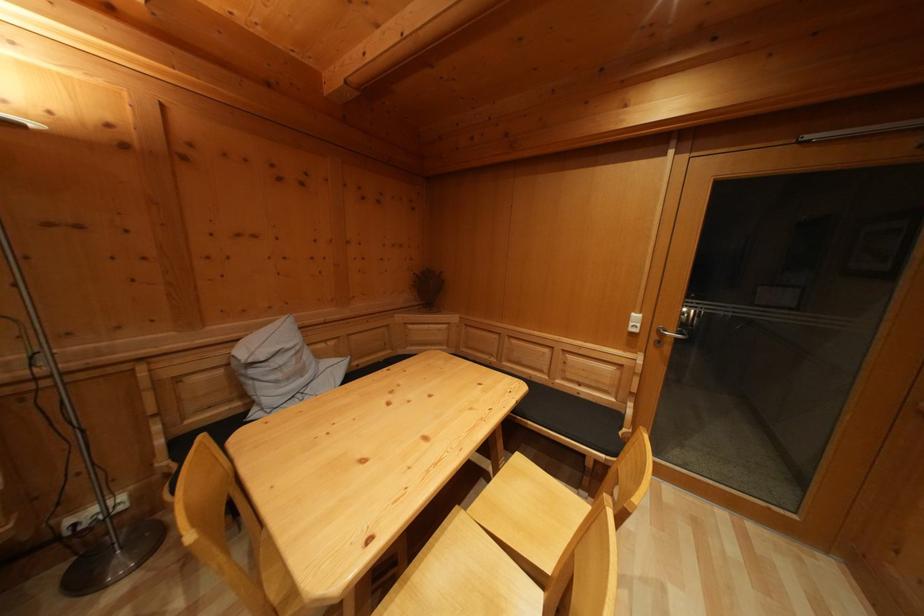
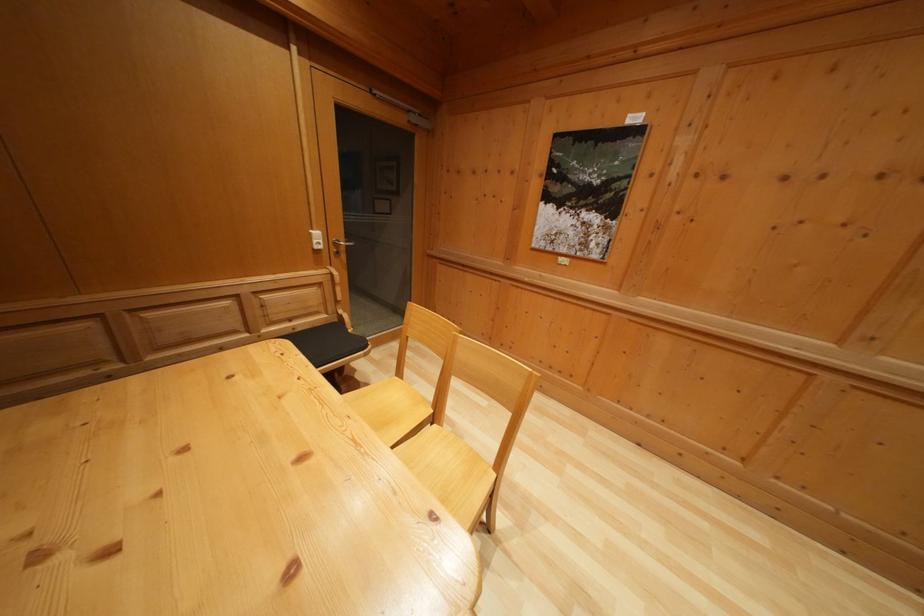
The point at (x=589, y=403) is marked in the first image. Where is the corresponding point in the second image?

(305, 336)